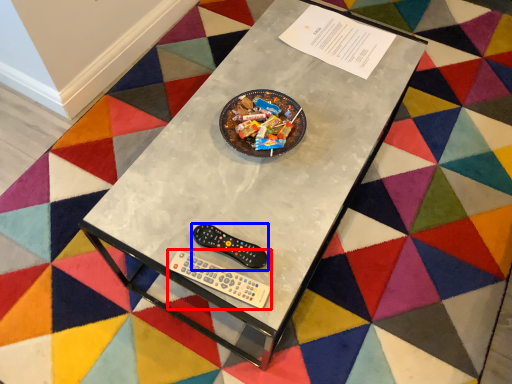
Question: Among these objects, which one is nearest to the camera, Wii controller (highlighted by a red box) or control (highlighted by a blue box)?

Choices:
 (A) Wii controller
 (B) control

Answer: (A)